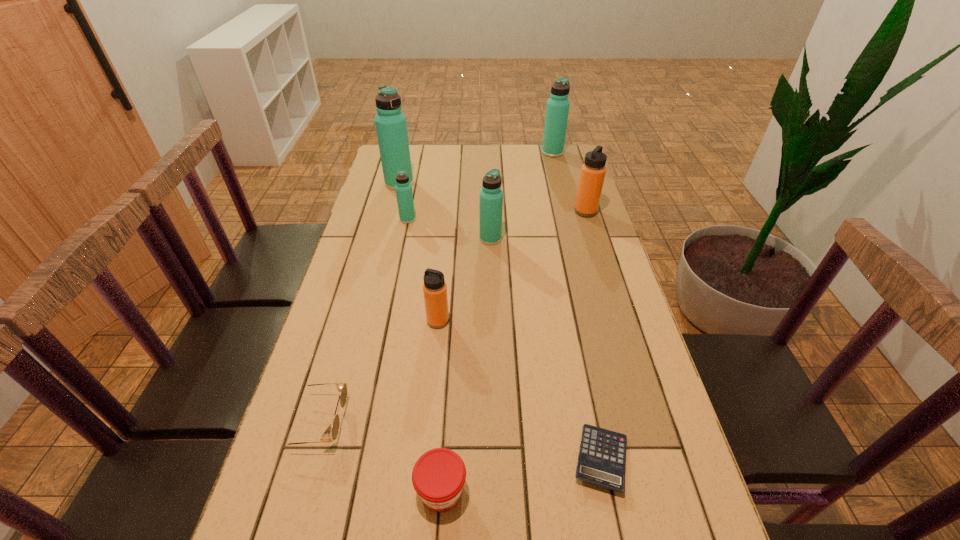
Locate an element on the screen. free space located on the front of the nearer orange thermos bottle is located at coordinates (432, 389).

Find the location of a particular element. This screenshot has height=540, width=960. vacant space located 0.220m on the front lenses of the eighth tallest object is located at coordinates (445, 422).

The width and height of the screenshot is (960, 540). Identify the location of vacant space located on the left of the calculator. (448, 459).

The height and width of the screenshot is (540, 960). Identify the location of object that is positioned at the far edge. (557, 109).

Locate an element on the screen. sunglasses positioned at the left edge is located at coordinates (342, 387).

Where is `calculator that is at the right edge`? The width and height of the screenshot is (960, 540). calculator that is at the right edge is located at coordinates (601, 461).

Identify the location of object present at the far right corner. (557, 109).

I want to click on vacant space at the left edge of the desktop, so tap(381, 235).

The width and height of the screenshot is (960, 540). Identify the location of free space at the right edge of the desktop. (655, 525).

Locate an element on the screen. vacant space at the far left corner of the desktop is located at coordinates (417, 158).